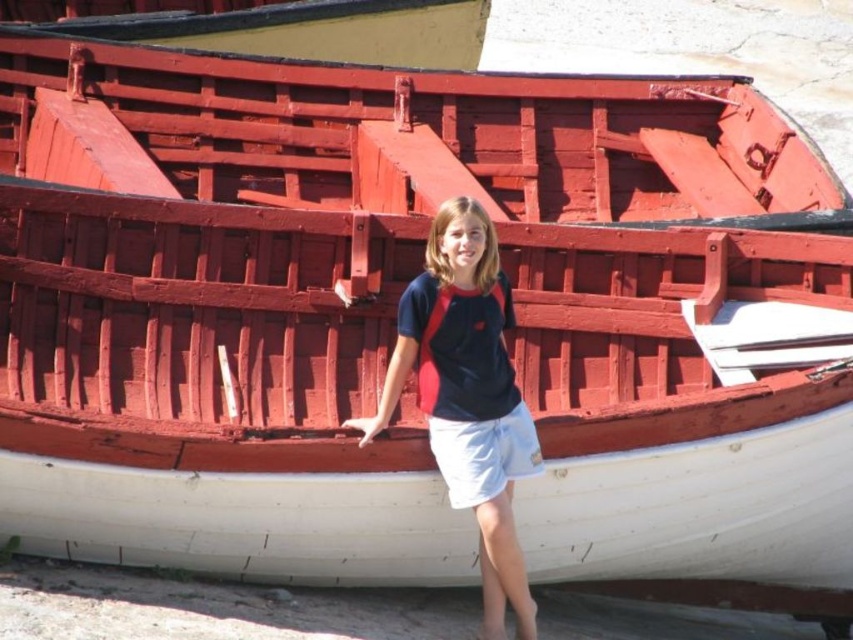
Between matte black shirt at center and smooth yellow wood boat at upper center, which one has more height?

matte black shirt at center is taller.

Can you confirm if matte black shirt at center is bigger than smooth yellow wood boat at upper center?

No, matte black shirt at center is not bigger than smooth yellow wood boat at upper center.

Between point (401, 349) and point (27, 32), which one is positioned behind?

The point (27, 32) is behind.

Find the location of a particular element. matte black shirt at center is located at coordinates (468, 396).